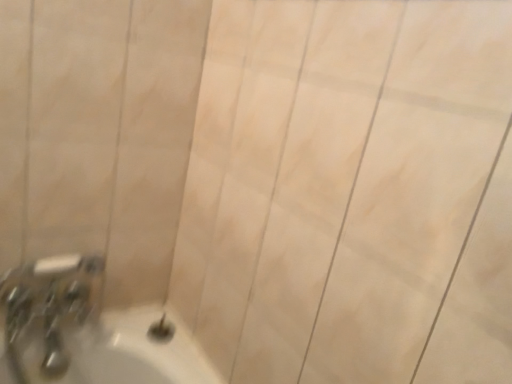
You are a GUI agent. You are given a task and a screenshot of the screen. Output one action in this format:
    pyautogui.click(x=<x>, y=<y>)
    Task: Click on the chrome metallic faucet at lower left
    Image resolution: width=512 pixels, height=384 pixels.
    Given the screenshot: What is the action you would take?
    pyautogui.click(x=49, y=311)

Describe the element at coordinates (49, 311) in the screenshot. I see `chrome metallic faucet at lower left` at that location.

Locate an element on the screen. This screenshot has width=512, height=384. chrome metallic faucet at lower left is located at coordinates (49, 311).